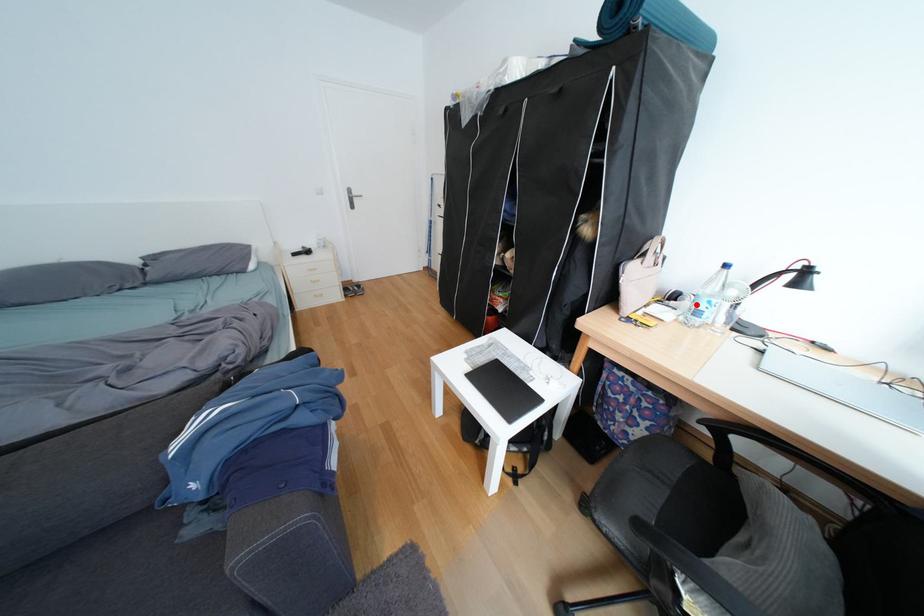
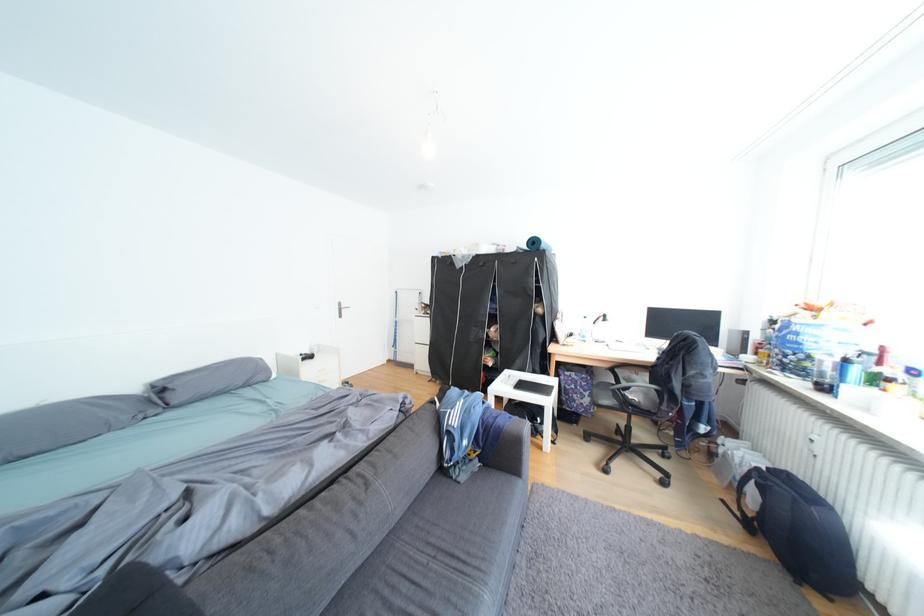
Question: I am providing you with two images of the same scene from different viewpoints. Image1 has a red point marked. In image2, the corresponding 3D location appears at what relative position? Reply with the corresponding letter.

Choices:
 (A) Closer
 (B) Farther

Answer: (B)